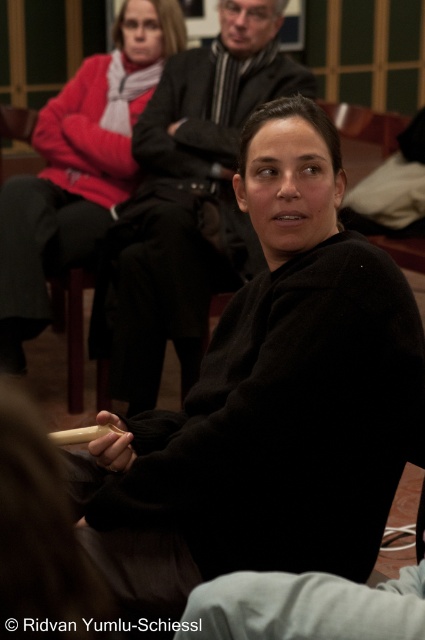
Image resolution: width=425 pixels, height=640 pixels. Describe the element at coordinates (189, 202) in the screenshot. I see `dark woolen sweater at center` at that location.

Is dark woolen sweater at center bigger than matte black sweater at upper left?

Correct, dark woolen sweater at center is larger in size than matte black sweater at upper left.

Find the location of a particular element. Image resolution: width=425 pixels, height=640 pixels. dark woolen sweater at center is located at coordinates (189, 202).

Where is `dark woolen sweater at center`? The width and height of the screenshot is (425, 640). dark woolen sweater at center is located at coordinates (189, 202).

Who is more forward, (359, 481) or (44, 211)?

Point (359, 481)

What do you see at coordinates (271, 400) in the screenshot? This screenshot has width=425, height=640. I see `black matte sweater at center` at bounding box center [271, 400].

Where is `black matte sweater at center`? black matte sweater at center is located at coordinates (271, 400).

You are a GUI agent. You are given a task and a screenshot of the screen. Output one action in this format:
    pyautogui.click(x=<x>, y=<y>)
    Task: Click on the black matte sweater at center
    The image size is (425, 640).
    Given the screenshot: What is the action you would take?
    pyautogui.click(x=271, y=400)

Does black matte sweater at center have a lesser width compared to dark woolen sweater at center?

Correct, black matte sweater at center's width is less than dark woolen sweater at center's.

Which is behind, point (280, 452) or point (130, 358)?

The point (130, 358) is behind.

Is point (274, 552) in front of point (127, 333)?

Yes, point (274, 552) is closer to viewer.

The image size is (425, 640). I want to click on black matte sweater at center, so click(271, 400).